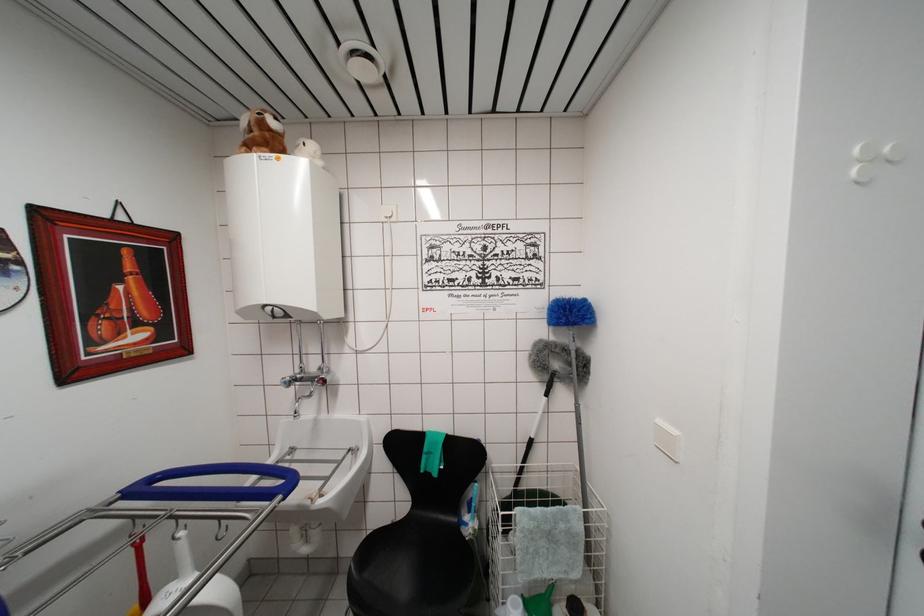
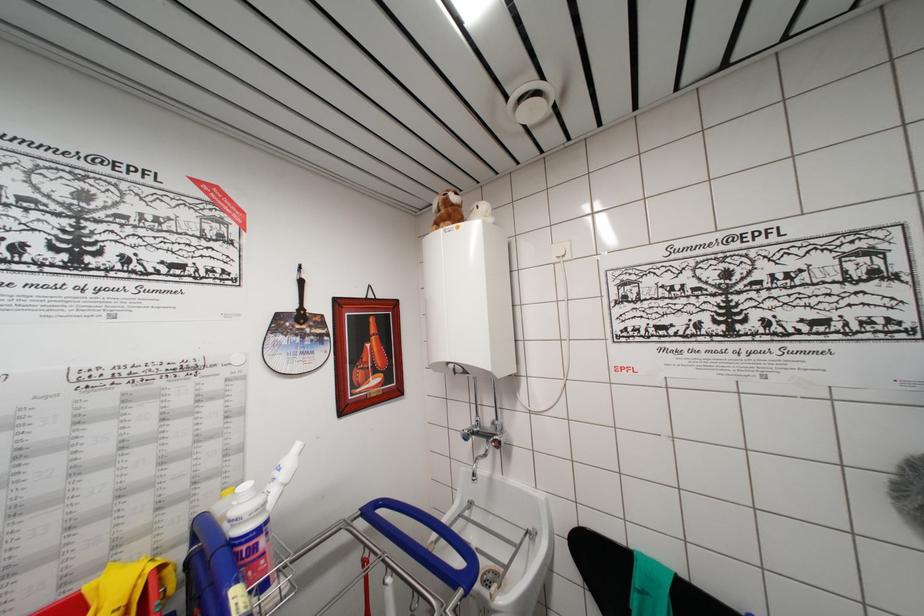
Question: The first image is from the beginning of the video and the second image is from the end. How did the camera likely rotate when shooting the video?

Choices:
 (A) Left
 (B) Right
 (C) Up
 (D) Down

Answer: (A)